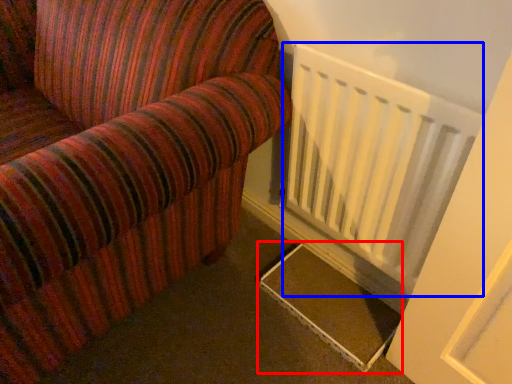
Question: Which point is further to the camera, stairs (highlighted by a red box) or radiator (highlighted by a blue box)?

Choices:
 (A) stairs
 (B) radiator

Answer: (A)